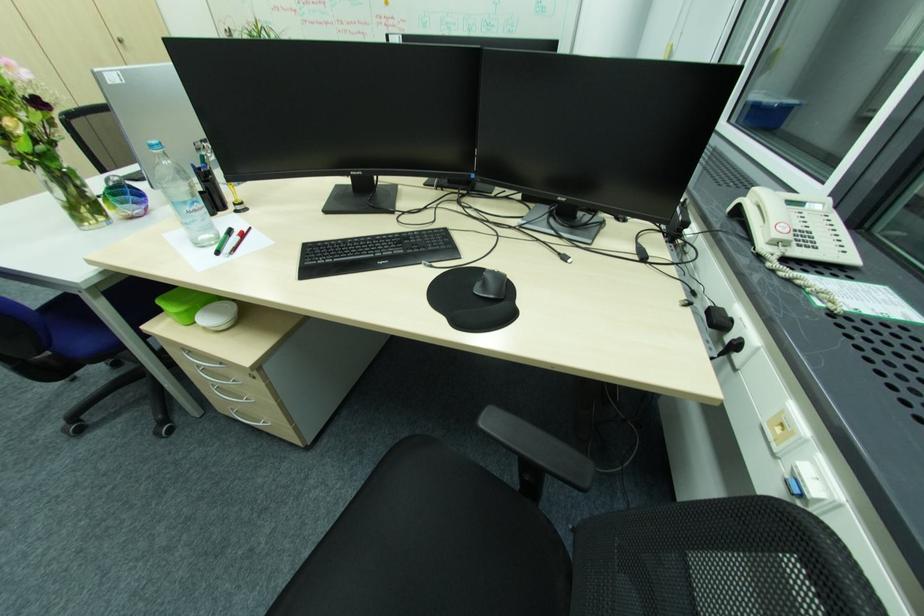
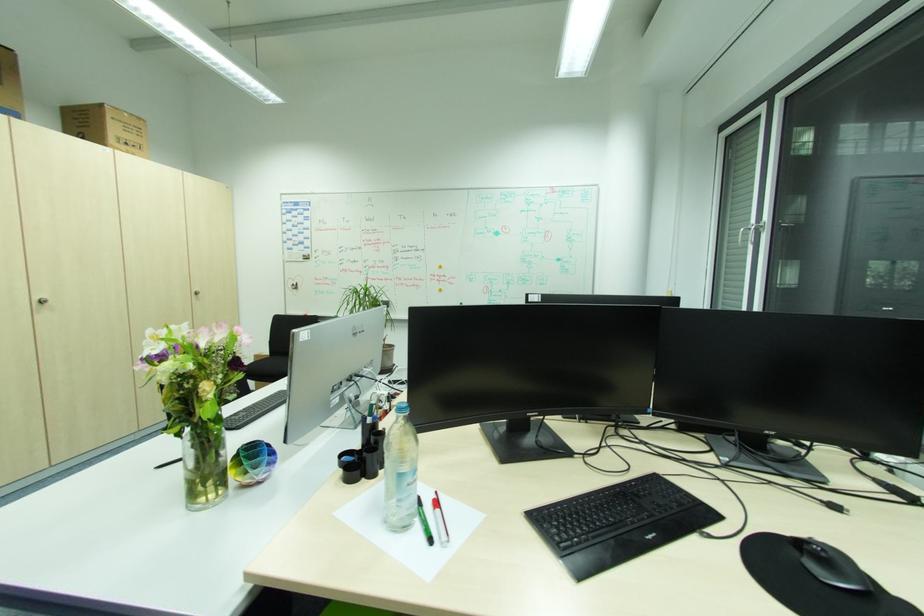
Find the pixel in the second image that matches (393,262) in the first image.

(660, 533)